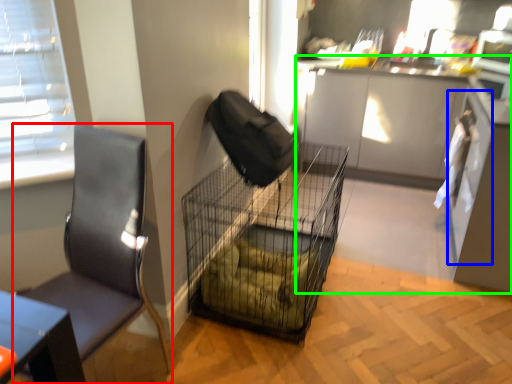
Question: Which object is positioned farthest from chair (highlighted by a red box)? Select from screen door (highlighted by a blue box) and cabinetry (highlighted by a green box).

Choices:
 (A) screen door
 (B) cabinetry

Answer: (B)